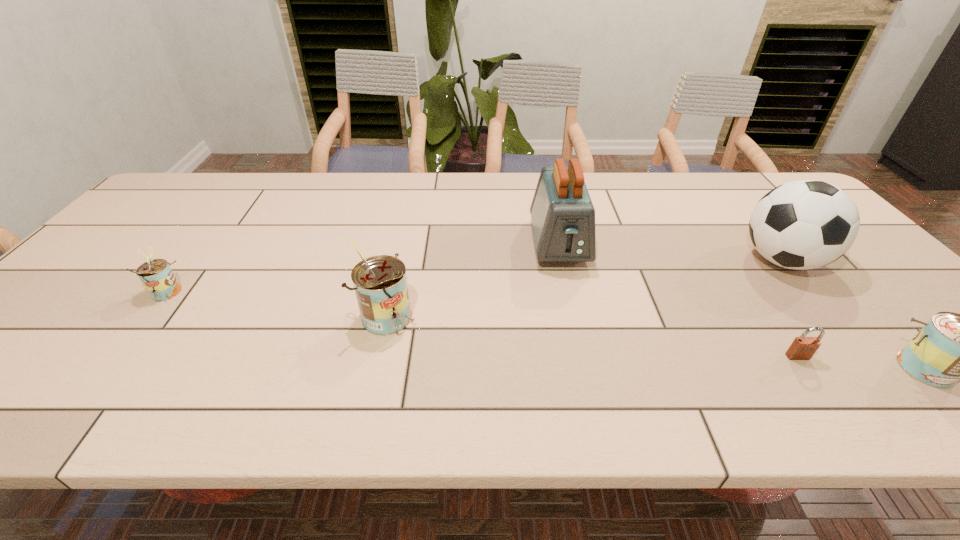
I want to click on free space that is in between the fifth object from right to left and the third object from left to right, so click(474, 279).

Image resolution: width=960 pixels, height=540 pixels. Find the location of `free area in between the soccer ball and the second can from right to left`. free area in between the soccer ball and the second can from right to left is located at coordinates [586, 288].

Where is `unoccupied position between the second object from left to right and the toaster`? This screenshot has width=960, height=540. unoccupied position between the second object from left to right and the toaster is located at coordinates (474, 279).

Point out which object is positioned as the fourth nearest to the soccer ball. Please provide its 2D coordinates. Your answer should be formatted as a tuple, i.e. [(x, y)], where the tuple contains the x and y coordinates of a point satisfying the conditions above.

[(380, 283)]

Locate an element on the screen. object that is the closest to the fifth object from right to left is located at coordinates (563, 217).

Image resolution: width=960 pixels, height=540 pixels. In order to click on the second closest can to the second shortest can in this screenshot , I will do `click(156, 275)`.

Locate an element on the screen. This screenshot has height=540, width=960. can that is the third nearest to the padlock is located at coordinates (156, 275).

Find the location of a particular element. free space that satisfies the following two spatial constraints: 1. on the back side of the second shortest object; 2. on the right side of the soccer ball is located at coordinates (189, 260).

Locate an element on the screen. This screenshot has height=540, width=960. free location that satisfies the following two spatial constraints: 1. on the front-facing side of the soccer ball; 2. on the right side of the toaster is located at coordinates (563, 260).

Identify the location of vacant region that satisfies the following two spatial constraints: 1. on the front-facing side of the toaster; 2. on the left side of the soccer ball. The height and width of the screenshot is (540, 960). (563, 260).